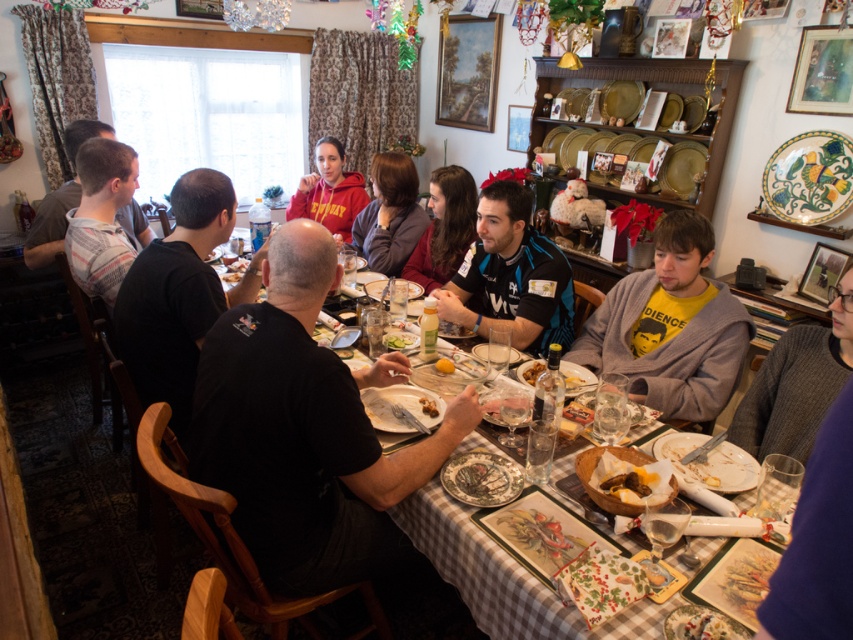
You are a guest at this dinner and want to place your napkin on the blue jersey at center. However, you also have a small plate of white creamy pasta at lower right nearby. Which item can you place the napkin on without it slipping off?

The blue jersey at center is bigger than the white creamy pasta at lower right, so the napkin can be placed on the blue jersey at center without slipping off.

You are a guest at this dinner and want to place your napkin on the table without covering any food items. Given the blue jersey at center and the yellowish matte bread at center are both at the center, which item should you avoid placing the napkin near to ensure it doesn not cover the larger object?

The blue jersey at center is wider than the yellowish matte bread at center, so you should avoid placing the napkin near the blue jersey at center to ensure it doesn not cover the larger object.

You are a guest at this dinner and need to place a small vase between the blue jersey at center and the white creamy pasta at lower right. Based on their sizes, which object should the vase be closer to?

The blue jersey at center is taller than the white creamy pasta at lower right, so the vase should be placed closer to the white creamy pasta at lower right to maintain balance between the two objects.